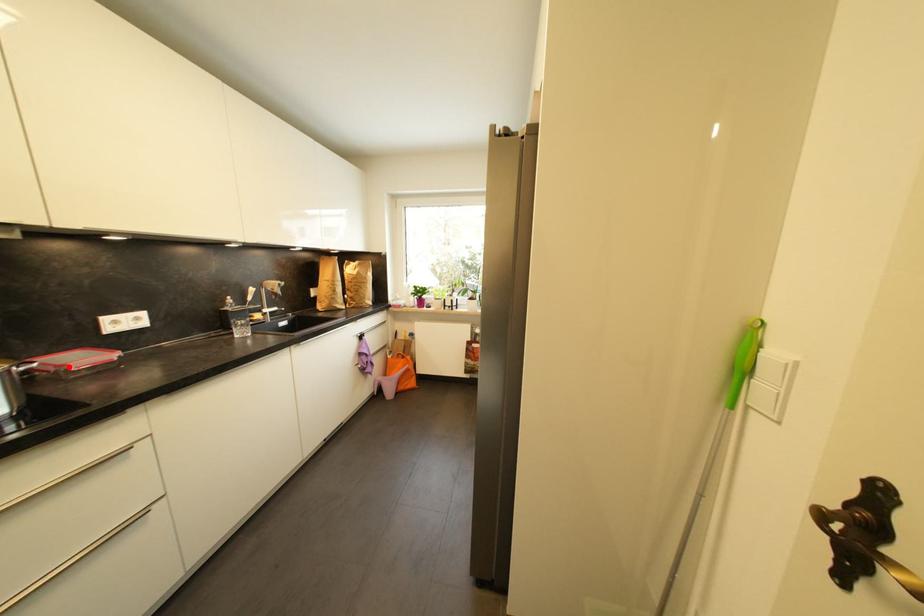
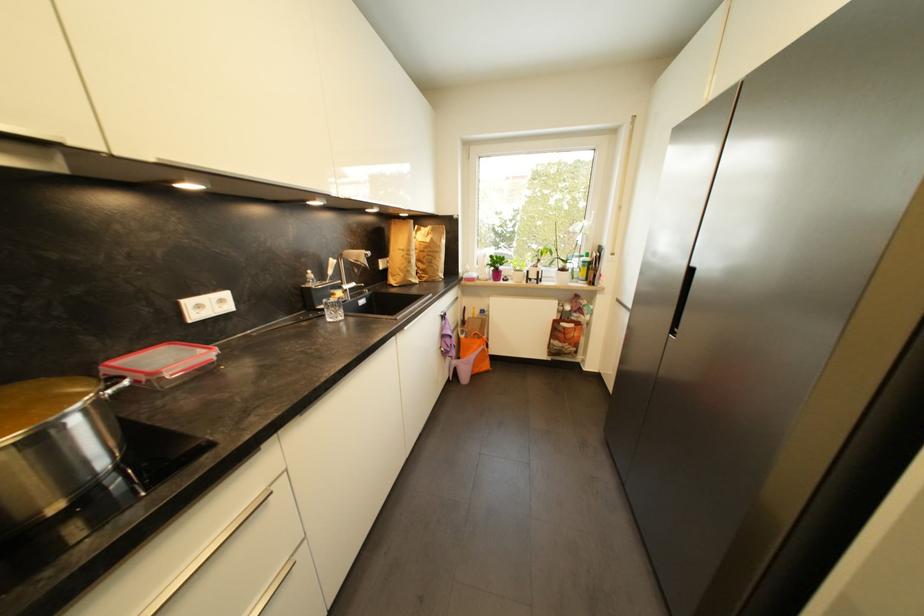
Find the pixel in the second image that matches the highlighted location in the first image.

(162, 375)